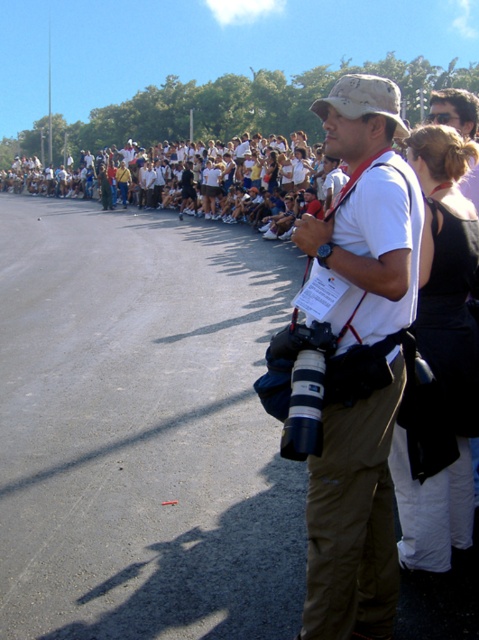
Measure the distance between white cotton shirt at center and camera.

7.53 feet

Who is more distant from viewer, [331,493] or [120,182]?

The point [120,182] is more distant.

Locate an element on the screen. white cotton shirt at center is located at coordinates (358, 358).